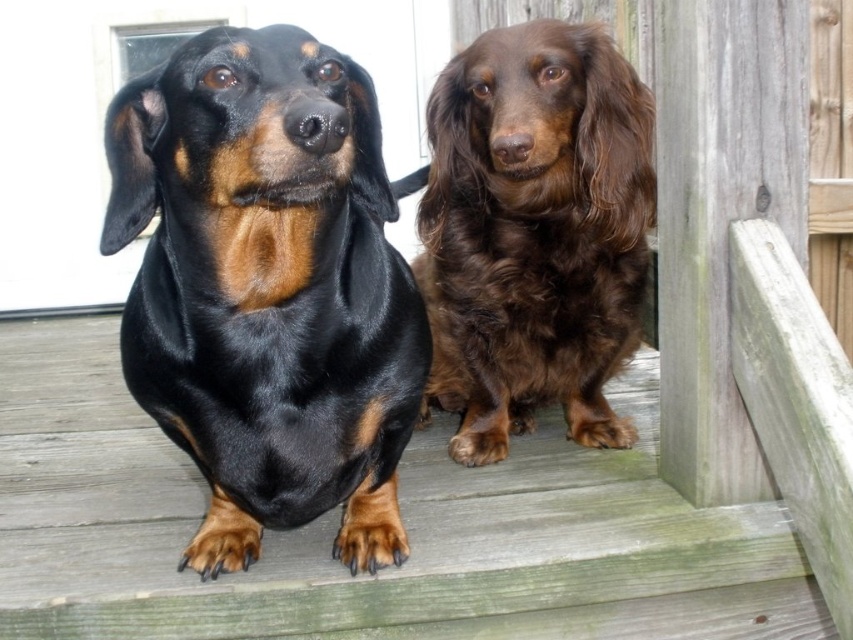
Between black shiny fur dog at center and brown shaggy dog at center, which one has less height?

Standing shorter between the two is black shiny fur dog at center.

What do you see at coordinates (267, 289) in the screenshot? The height and width of the screenshot is (640, 853). I see `black shiny fur dog at center` at bounding box center [267, 289].

Is point (239, 56) less distant than point (519, 387)?

Yes, it is.

Where is `black shiny fur dog at center`? The height and width of the screenshot is (640, 853). black shiny fur dog at center is located at coordinates (267, 289).